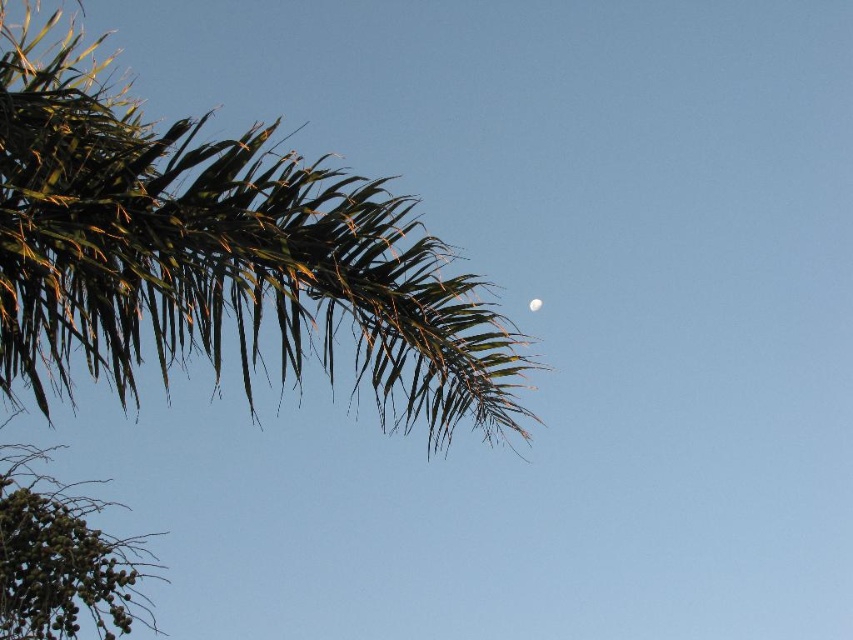
Question: Where is green leafy palm at upper left located in relation to white glossy moon at upper center in the image?

Choices:
 (A) right
 (B) left

Answer: (B)

Question: Is green leafy palm at upper left to the right of white glossy moon at upper center from the viewer's perspective?

Choices:
 (A) no
 (B) yes

Answer: (A)

Question: Which object appears closest to the camera in this image?

Choices:
 (A) green leafy palm at upper left
 (B) white glossy moon at upper center

Answer: (A)

Question: Does green leafy palm at upper left have a larger size compared to white glossy moon at upper center?

Choices:
 (A) no
 (B) yes

Answer: (B)